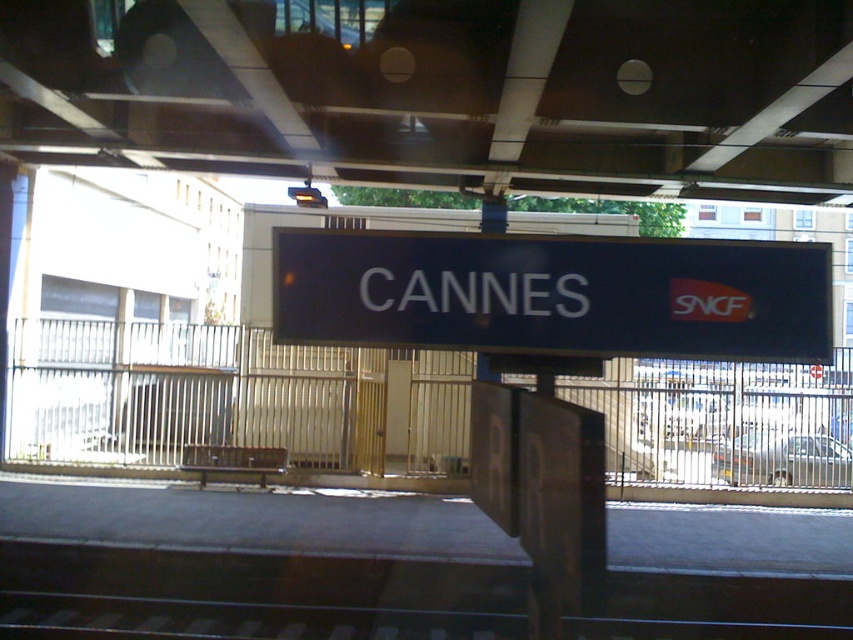
Question: Can you confirm if metal at center is bigger than black matte sign at center?

Choices:
 (A) yes
 (B) no

Answer: (A)

Question: Which object is closer to the camera taking this photo?

Choices:
 (A) metal at center
 (B) black matte sign at center

Answer: (B)

Question: Which of the following is the farthest from the observer?

Choices:
 (A) metal at center
 (B) black matte sign at center

Answer: (A)

Question: Among these points, which one is nearest to the camera?

Choices:
 (A) (556, 33)
 (B) (611, 353)

Answer: (B)

Question: Does metal at center appear over black matte sign at center?

Choices:
 (A) no
 (B) yes

Answer: (B)

Question: In this image, where is metal at center located relative to black matte sign at center?

Choices:
 (A) right
 (B) left

Answer: (B)